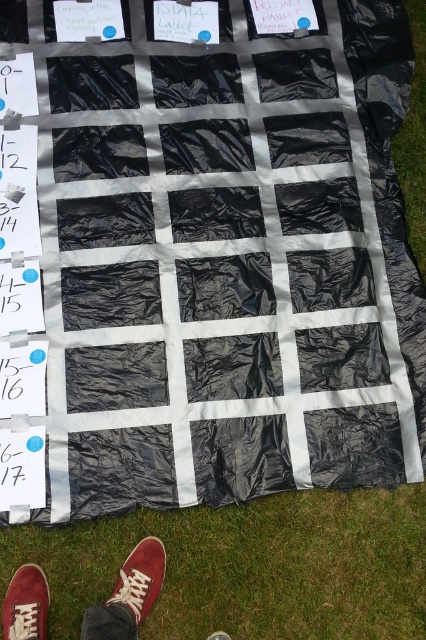
Question: Based on their relative distances, which object is farther from the green grass at lower center?

Choices:
 (A) brown suede shoe at lower left
 (B) suede/leather shoe at lower center
 (C) white canvas shoe at lower center

Answer: (A)

Question: Considering the real-world distances, which object is farthest from the brown suede shoe at lower left?

Choices:
 (A) suede/leather shoe at lower center
 (B) green grass at lower center

Answer: (B)

Question: Does green grass at lower center lie behind brown suede shoe at lower left?

Choices:
 (A) yes
 (B) no

Answer: (A)

Question: Estimate the real-world distances between objects in this image. Which object is farther from the green grass at lower center?

Choices:
 (A) suede/leather shoe at lower center
 (B) white canvas shoe at lower center
 (C) brown suede shoe at lower left

Answer: (C)

Question: Does green grass at lower center lie in front of brown suede shoe at lower left?

Choices:
 (A) no
 (B) yes

Answer: (A)

Question: From the image, what is the correct spatial relationship of brown suede shoe at lower left in relation to white canvas shoe at lower center?

Choices:
 (A) right
 (B) left

Answer: (B)